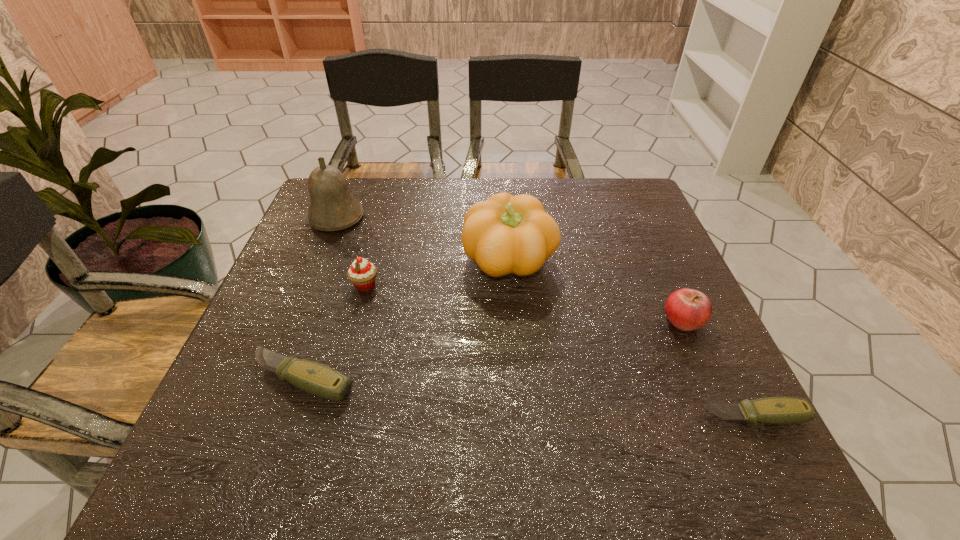
Identify the location of free space between the right pocketknife and the fourth farthest object. The image size is (960, 540). (719, 368).

The width and height of the screenshot is (960, 540). Find the location of `empty space between the pumpkin and the bell`. empty space between the pumpkin and the bell is located at coordinates (423, 240).

I want to click on unoccupied position between the cupcake and the bell, so click(x=350, y=252).

I want to click on free spot between the shorter pocketknife and the bell, so click(545, 317).

Image resolution: width=960 pixels, height=540 pixels. I want to click on unoccupied position between the taller pocketknife and the cupcake, so click(334, 332).

Where is `free space between the taller pocketknife and the shortest object`? free space between the taller pocketknife and the shortest object is located at coordinates (529, 397).

Locate an element on the screen. This screenshot has width=960, height=540. unoccupied area between the cupcake and the fourth object from left to right is located at coordinates (438, 273).

I want to click on unoccupied area between the bell and the fourth object from left to right, so click(423, 240).

Locate an element on the screen. object that stands as the second closest to the bell is located at coordinates (505, 234).

Select which object is the second closest to the apple. Please provide its 2D coordinates. Your answer should be formatted as a tuple, i.e. [(x, y)], where the tuple contains the x and y coordinates of a point satisfying the conditions above.

[(505, 234)]